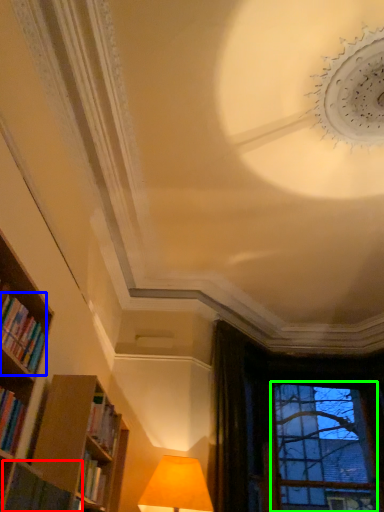
Question: Based on their relative distances, which object is farther from book (highlighted by a red box)? Choose from book (highlighted by a blue box) and bay window (highlighted by a green box).

Choices:
 (A) book
 (B) bay window

Answer: (B)